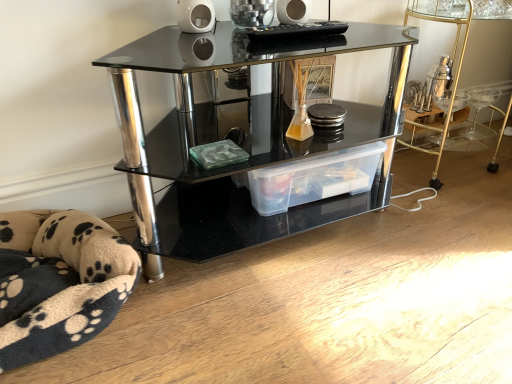
Question: Is the depth of transparent plastic storage box at center greater than that of clear plastic storage container at lower right?

Choices:
 (A) yes
 (B) no

Answer: (B)

Question: Is transparent plastic storage box at center next to clear plastic storage container at lower right and touching it?

Choices:
 (A) yes
 (B) no

Answer: (B)

Question: Is transparent plastic storage box at center not within clear plastic storage container at lower right?

Choices:
 (A) yes
 (B) no

Answer: (A)

Question: From a real-world perspective, is transparent plastic storage box at center under clear plastic storage container at lower right?

Choices:
 (A) no
 (B) yes

Answer: (B)

Question: Is transparent plastic storage box at center to the left of clear plastic storage container at lower right from the viewer's perspective?

Choices:
 (A) no
 (B) yes

Answer: (B)

Question: In the image, is black glass shelf at center on the left side or the right side of transparent plastic storage box at center?

Choices:
 (A) right
 (B) left

Answer: (B)

Question: In terms of width, does black glass shelf at center look wider or thinner when compared to transparent plastic storage box at center?

Choices:
 (A) wide
 (B) thin

Answer: (A)

Question: Is black glass shelf at center inside or outside of transparent plastic storage box at center?

Choices:
 (A) outside
 (B) inside

Answer: (A)

Question: From the image's perspective, relative to transparent plastic storage box at center, is black glass shelf at center above or below?

Choices:
 (A) below
 (B) above

Answer: (B)

Question: Considering their positions, is beige fleece pet bed at lower left located in front of or behind transparent plastic storage box at center?

Choices:
 (A) behind
 (B) front

Answer: (B)

Question: Which is correct: beige fleece pet bed at lower left is inside transparent plastic storage box at center, or outside of it?

Choices:
 (A) outside
 (B) inside

Answer: (A)

Question: From a real-world perspective, is beige fleece pet bed at lower left above or below transparent plastic storage box at center?

Choices:
 (A) above
 (B) below

Answer: (B)

Question: Would you say beige fleece pet bed at lower left is to the left or to the right of transparent plastic storage box at center in the picture?

Choices:
 (A) right
 (B) left

Answer: (B)

Question: Choose the correct answer: Is transparent plastic storage box at center inside black glass shelf at center or outside it?

Choices:
 (A) outside
 (B) inside

Answer: (B)

Question: Considering the positions of transparent plastic storage box at center and black glass shelf at center in the image, is transparent plastic storage box at center wider or thinner than black glass shelf at center?

Choices:
 (A) wide
 (B) thin

Answer: (B)